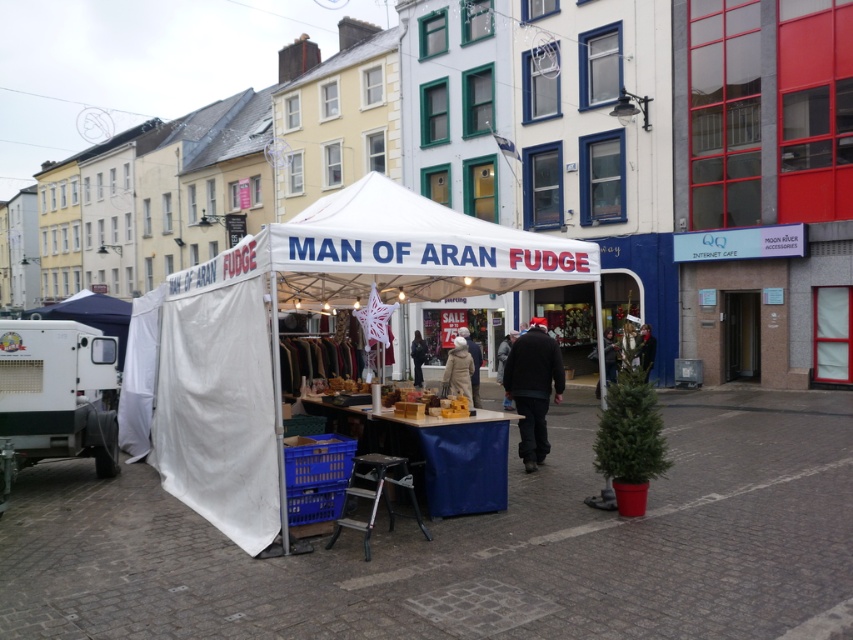
Question: Does white woolen hat at center appear on the left side of dark blue jacket at center?

Choices:
 (A) no
 (B) yes

Answer: (A)

Question: Which point is farther to the camera?

Choices:
 (A) white fabric canopy at center
 (B) dark brown leather jacket at center

Answer: (B)

Question: Which object is positioned farthest from the white fabric tent at center?

Choices:
 (A) metallic silver stool at lower center
 (B) dark blue jacket at center
 (C) dark brown leather jacket at center

Answer: (B)

Question: Is white fabric canopy at center positioned behind dark blue jacket at center?

Choices:
 (A) no
 (B) yes

Answer: (A)

Question: Among these points, which one is farthest from the camera?

Choices:
 (A) (416, 346)
 (B) (520, 342)
 (C) (258, 442)
 (D) (294, 301)

Answer: (A)

Question: Does dark brown leather jacket at center have a lesser width compared to metallic silver stool at lower center?

Choices:
 (A) no
 (B) yes

Answer: (B)